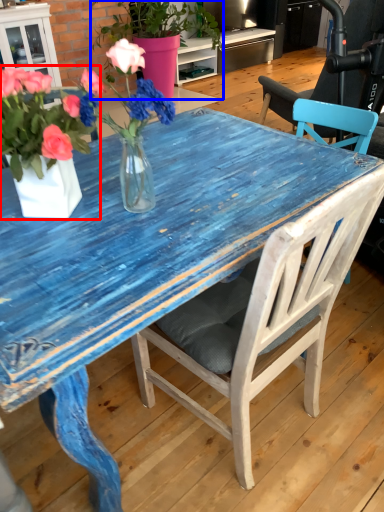
Question: Which of the following is the closest to the observer, houseplant (highlighted by a red box) or houseplant (highlighted by a blue box)?

Choices:
 (A) houseplant
 (B) houseplant

Answer: (A)